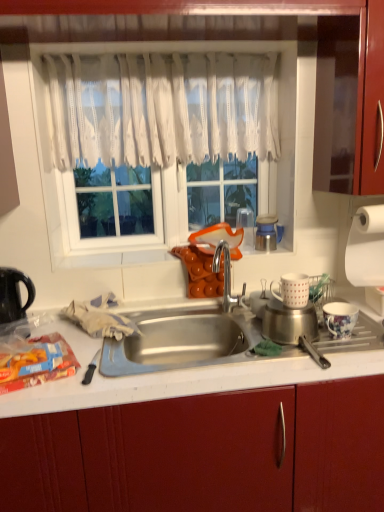
Question: Looking at the image, does metallic blue thermos at upper right, which is the 3th appliance in right-to-left order, seem bigger or smaller compared to white lace curtain at upper center?

Choices:
 (A) small
 (B) big

Answer: (A)

Question: Relative to white lace curtain at upper center, is metallic blue thermos at upper right, the third appliance when ordered from left to right, in front or behind?

Choices:
 (A) behind
 (B) front

Answer: (A)

Question: Estimate the real-world distances between objects in this image. Which object is closer to the orange matte cups at center?

Choices:
 (A) white lace curtain at upper center
 (B) white matte mug at right, which is the fourth appliance from right to left
 (C) translucent plastic bag of frozen vegetables at lower left
 (D) white paper towel at upper right, arranged as the fifth appliance when viewed from the left
 (E) white lace curtain at upper center

Answer: (E)

Question: Estimate the real-world distances between objects in this image. Which object is closer to the black plastic kettle at left?

Choices:
 (A) white paper towel at upper right, acting as the 1th appliance starting from the right
 (B) white matte mug at right, the second appliance in the left-to-right sequence
 (C) porcelain floral cup at right, marked as the second appliance in a right-to-left arrangement
 (D) white lace curtain at upper center
 (E) orange matte cups at center

Answer: (E)